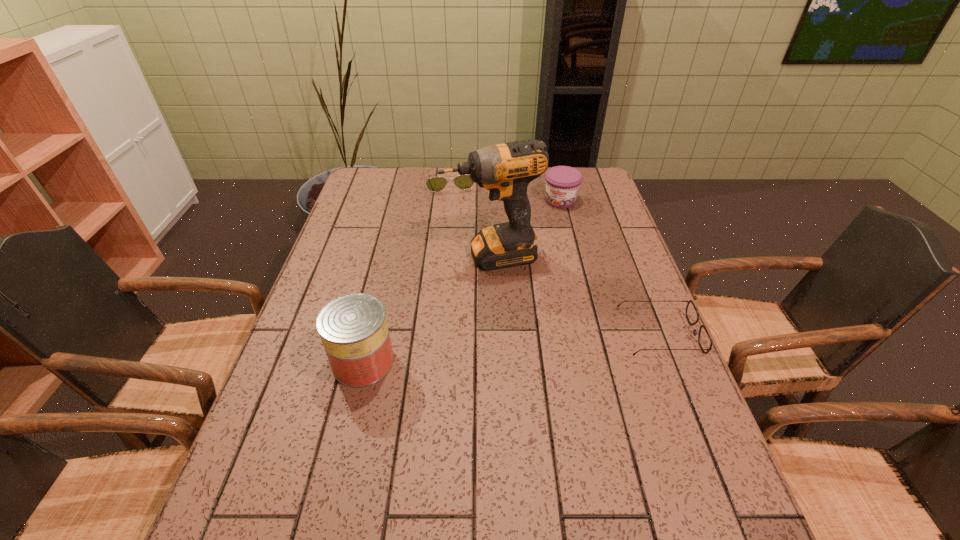
This screenshot has height=540, width=960. I want to click on empty space that is in between the right sunglasses and the third tallest object, so click(610, 267).

Identify the location of vacant space that's between the left sunglasses and the third nearest object. Image resolution: width=960 pixels, height=540 pixels. (469, 217).

I want to click on free space between the jam and the can, so click(462, 281).

Locate an element on the screen. Image resolution: width=960 pixels, height=540 pixels. empty space that is in between the right sunglasses and the farther sunglasses is located at coordinates 554,256.

Find the location of a particular element. This screenshot has width=960, height=540. unoccupied area between the fourth shortest object and the left sunglasses is located at coordinates (406, 270).

The image size is (960, 540). I want to click on free space between the rightmost object and the tallest object, so click(575, 295).

Where is `unoccupied area between the third nearest object and the left sunglasses`? This screenshot has height=540, width=960. unoccupied area between the third nearest object and the left sunglasses is located at coordinates 469,217.

This screenshot has height=540, width=960. What are the coordinates of `free area in between the nearer sunglasses and the second tallest object` in the screenshot? It's located at (511, 348).

Identify which object is located as the fourth nearest to the right sunglasses. Please provide its 2D coordinates. Your answer should be formatted as a tuple, i.e. [(x, y)], where the tuple contains the x and y coordinates of a point satisfying the conditions above.

[(464, 182)]

Where is `object identified as the fourth closest to the farther sunglasses`? Image resolution: width=960 pixels, height=540 pixels. object identified as the fourth closest to the farther sunglasses is located at coordinates (704, 339).